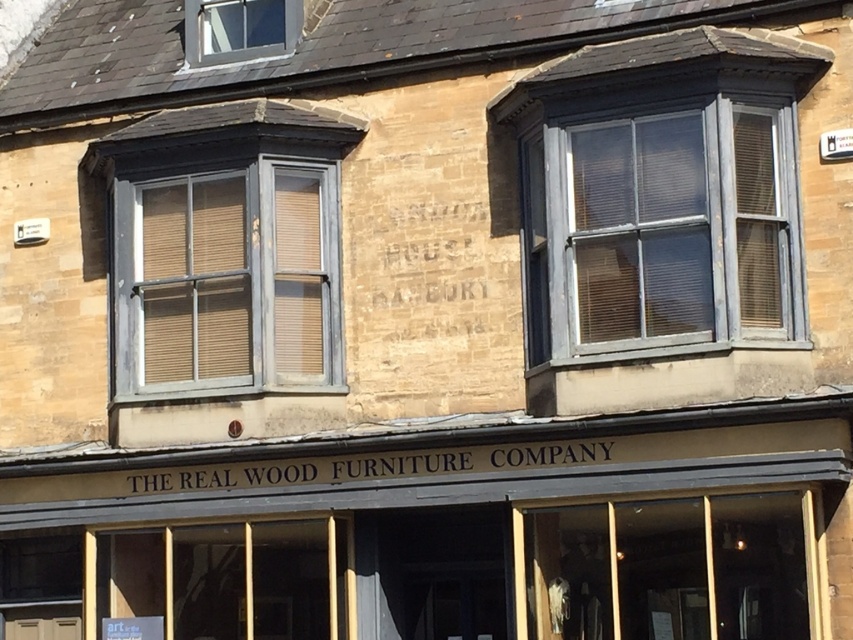
Can you confirm if matte gray wood window at center left is taller than brown wooden signboard at center?

No, matte gray wood window at center left is not taller than brown wooden signboard at center.

Is point (122, 317) positioned in front of point (76, 513)?

No.

The width and height of the screenshot is (853, 640). Identify the location of matte gray wood window at center left. (227, 280).

Can you confirm if blue-gray wood window at upper right is positioned below brown wooden signboard at center?

Incorrect, blue-gray wood window at upper right is not positioned below brown wooden signboard at center.

Is point (743, 288) closer to camera compared to point (122, 492)?

Yes, it is.

Where is `blue-gray wood window at upper right`? blue-gray wood window at upper right is located at coordinates (660, 192).

Measure the distance from brown wooden signboard at center to clear glass window at upper left.

8.00 meters

This screenshot has height=640, width=853. What are the coordinates of `brown wooden signboard at center` in the screenshot? It's located at (450, 476).

This screenshot has width=853, height=640. I want to click on brown wooden signboard at center, so click(450, 476).